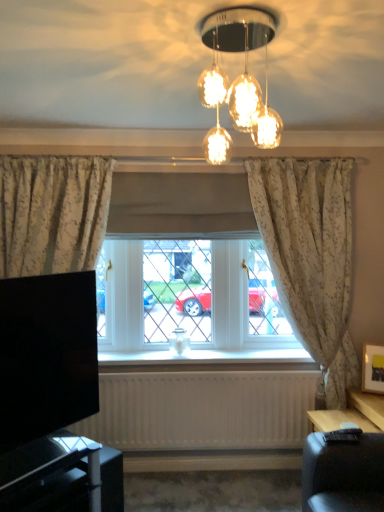
What do you see at coordinates (208, 360) in the screenshot?
I see `white wood window sill at center` at bounding box center [208, 360].

Find the location of `black glossy tv at lower left`. black glossy tv at lower left is located at coordinates (46, 355).

Describe the element at coordinates (311, 257) in the screenshot. Image resolution: width=384 pixels, height=512 pixels. I see `floral fabric curtain at right` at that location.

Locate an element on the screen. white textured radiator at lower center is located at coordinates (202, 410).

At what (x,y) coordinates should I click in order to perform the action: click on window sill located on the left of wooden framed picture at right. Please return your answer as a coordinate pair (x, y). This screenshot has width=384, height=512. Looking at the image, I should click on (208, 360).

Is white wood window sill at center next to wooden framed picture at right and touching it?

No, white wood window sill at center is not next to wooden framed picture at right.

From their relative heights in the image, would you say white wood window sill at center is taller or shorter than wooden framed picture at right?

Clearly, white wood window sill at center is shorter compared to wooden framed picture at right.

Does wooden framed picture at right have a greater height compared to white wood window sill at center?

Indeed, wooden framed picture at right has a greater height compared to white wood window sill at center.

From a real-world perspective, which object stands above the other?

white wood window sill at center is physically above.

Does wooden framed picture at right have a greater width compared to white wood window sill at center?

No.

From the image's perspective, which one is positioned higher, wooden framed picture at right or white wood window sill at center?

white wood window sill at center.

Is white wood window sill at center shorter than black glossy tv stand at lower left?

Yes.

Choose the correct answer: Is white wood window sill at center inside black glossy tv stand at lower left or outside it?

white wood window sill at center lies outside black glossy tv stand at lower left.

From a real-world perspective, is white wood window sill at center under black glossy tv stand at lower left?

No, from a real-world perspective, white wood window sill at center is not below black glossy tv stand at lower left.

Considering the positions of point (286, 367) and point (68, 464), is point (286, 367) closer or farther from the camera than point (68, 464)?

Clearly, point (286, 367) is more distant from the camera than point (68, 464).

How far apart are wooden framed picture at right and white textured radiator at lower center?

They are 93.78 centimeters apart.

Who is bigger, wooden framed picture at right or white textured radiator at lower center?

Bigger between the two is white textured radiator at lower center.

From the image's perspective, is wooden framed picture at right on top of white textured radiator at lower center?

Indeed, from the image's perspective, wooden framed picture at right is shown above white textured radiator at lower center.

Considering the relative positions of wooden framed picture at right and white textured radiator at lower center in the image provided, is wooden framed picture at right to the left of white textured radiator at lower center from the viewer's perspective?

In fact, wooden framed picture at right is to the right of white textured radiator at lower center.

From the picture: Which of these two, black glossy tv stand at lower left or black glossy tv at lower left, is bigger?

Bigger between the two is black glossy tv stand at lower left.

Is black glossy tv at lower left inside black glossy tv stand at lower left?

Actually, black glossy tv at lower left is outside black glossy tv stand at lower left.

Is point (71, 463) closer or farther from the camera than point (28, 401)?

Clearly, point (71, 463) is more distant from the camera than point (28, 401).

Considering the sizes of objects black glossy tv at lower left and black glossy tv stand at lower left in the image provided, who is smaller, black glossy tv at lower left or black glossy tv stand at lower left?

black glossy tv at lower left is smaller.

Would you say black glossy tv at lower left is inside or outside black glossy tv stand at lower left?

The correct answer is: outside.

Would you consider black glossy tv at lower left to be distant from black glossy tv stand at lower left?

black glossy tv at lower left is actually quite close to black glossy tv stand at lower left.

Is black glossy tv at lower left looking in the opposite direction of black glossy tv stand at lower left?

black glossy tv at lower left does not have its back to black glossy tv stand at lower left.

Is point (275, 21) behind point (248, 421)?

No.

Can you confirm if translucent glass light fixture at upper center is shorter than white textured radiator at lower center?

Indeed, translucent glass light fixture at upper center has a lesser height compared to white textured radiator at lower center.

Locate an element on the screen. radiator below the translucent glass light fixture at upper center (from a real-world perspective) is located at coordinates (202, 410).

Could you tell me if translucent glass light fixture at upper center is turned towards white textured radiator at lower center?

No, translucent glass light fixture at upper center does not turn towards white textured radiator at lower center.

Find the location of a particular element. This screenshot has width=384, height=512. window sill located above the wooden framed picture at right (from the image's perspective) is located at coordinates (208, 360).

Where is `picture frame on the right of white wood window sill at center`? picture frame on the right of white wood window sill at center is located at coordinates (373, 368).

Looking at this image, from the image, which object appears to be nearer to white textured radiator at lower center, white wood window sill at center or floral fabric curtain at right?

white wood window sill at center lies closer to white textured radiator at lower center than the other object.

Based on the photo, when comparing their distances from wooden framed picture at right, does black glossy tv at lower left or white wood window sill at center seem closer?

The object closer to wooden framed picture at right is white wood window sill at center.

Which object lies nearer to the anchor point white textured radiator at lower center, black glossy tv stand at lower left or wooden framed picture at right?

black glossy tv stand at lower left is closer to white textured radiator at lower center.

Looking at the image, which one is located closer to black glossy tv at lower left, wooden framed picture at right or floral fabric curtain at right?

floral fabric curtain at right.

Which object lies further to the anchor point black glossy tv stand at lower left, translucent glass light fixture at upper center or wooden framed picture at right?

translucent glass light fixture at upper center lies further to black glossy tv stand at lower left than the other object.

Estimate the real-world distances between objects in this image. Which object is further from black glossy tv stand at lower left, white textured radiator at lower center or wooden framed picture at right?

wooden framed picture at right is further to black glossy tv stand at lower left.

Considering their positions, is black glossy tv stand at lower left positioned further to wooden framed picture at right than floral fabric curtain at right?

black glossy tv stand at lower left is positioned further to the anchor wooden framed picture at right.

Looking at this image, from the image, which object appears to be farther from white wood window sill at center, floral fabric curtain at right or white textured radiator at lower center?

floral fabric curtain at right is further to white wood window sill at center.

At what (x,y) coordinates should I click in order to perform the action: click on window sill located between white textured radiator at lower center and floral fabric curtain at right in the left-right direction. Please return your answer as a coordinate pair (x, y). The width and height of the screenshot is (384, 512). Looking at the image, I should click on (208, 360).

The width and height of the screenshot is (384, 512). Find the location of `radiator located between black glossy tv stand at lower left and floral fabric curtain at right in the left-right direction`. radiator located between black glossy tv stand at lower left and floral fabric curtain at right in the left-right direction is located at coordinates (202, 410).

What are the coordinates of `radiator between black glossy tv at lower left and wooden framed picture at right in the horizontal direction` in the screenshot? It's located at (202, 410).

You are a GUI agent. You are given a task and a screenshot of the screen. Output one action in this format:
    pyautogui.click(x=<x>, y=<y>)
    Task: Click on the curtain between translucent glass light fixture at upper center and white textured radiator at lower center along the z-axis
    
    Given the screenshot: What is the action you would take?
    pyautogui.click(x=311, y=257)